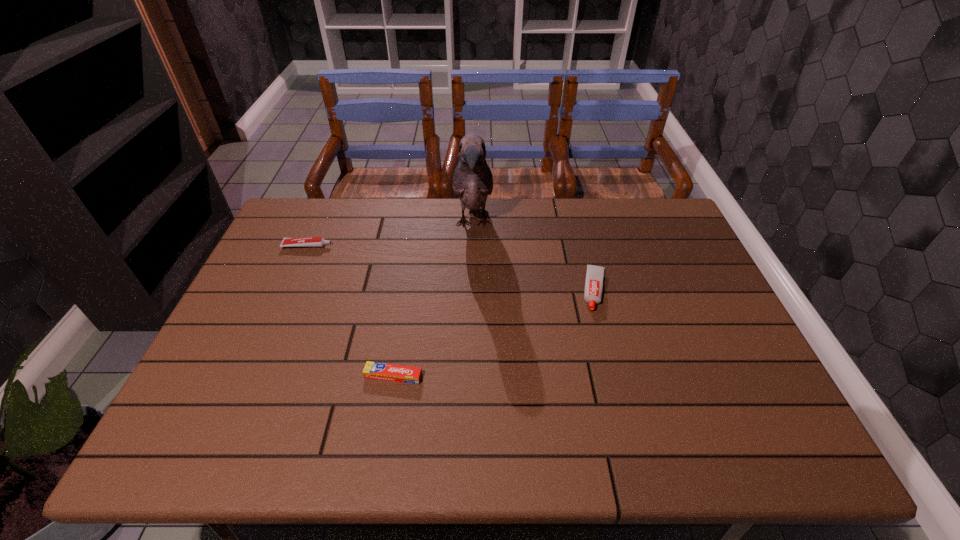
The width and height of the screenshot is (960, 540). I want to click on free space located at the nozzle of the farthest toothpaste, so click(x=375, y=246).

Locate an element on the screen. free space located 0.330m on the right of the third object from right to left is located at coordinates (x=561, y=376).

Identify the location of object that is at the far edge. (472, 181).

The width and height of the screenshot is (960, 540). In order to click on object at the left edge in this screenshot , I will do `click(307, 241)`.

Identify the location of vacant space at the far edge of the desktop. (598, 238).

The image size is (960, 540). In order to click on vacant space at the near edge of the desktop in this screenshot , I will do `click(718, 454)`.

Where is `vacant space at the left edge of the desktop`? The height and width of the screenshot is (540, 960). vacant space at the left edge of the desktop is located at coordinates (276, 278).

In the image, there is a desktop. Where is `vacant space at the right edge`? vacant space at the right edge is located at coordinates (768, 418).

What are the coordinates of `vacant space at the far left corner` in the screenshot? It's located at (275, 234).

What are the coordinates of `vacant area at the far right corner of the desktop` in the screenshot? It's located at (628, 199).